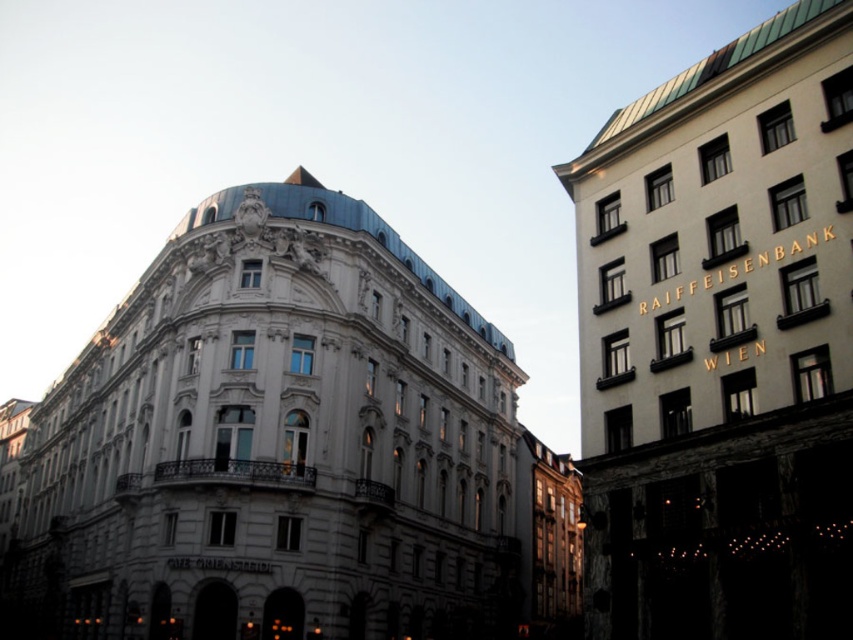
Question: Which of the following is the closest to the observer?

Choices:
 (A) (746, 477)
 (B) (161, 294)

Answer: (A)

Question: Which object is closer to the camera taking this photo?

Choices:
 (A) white stone building at center
 (B) matte white building at center

Answer: (B)

Question: Which point is farther to the camera?

Choices:
 (A) white stone building at upper right
 (B) white stone building at center

Answer: (B)

Question: Can you confirm if white stone building at center is smaller than matte white building at center?

Choices:
 (A) yes
 (B) no

Answer: (B)

Question: From the image, what is the correct spatial relationship of white stone building at upper right in relation to matte white building at center?

Choices:
 (A) right
 (B) left

Answer: (A)

Question: Is white stone building at upper right in front of matte white building at center?

Choices:
 (A) yes
 (B) no

Answer: (A)